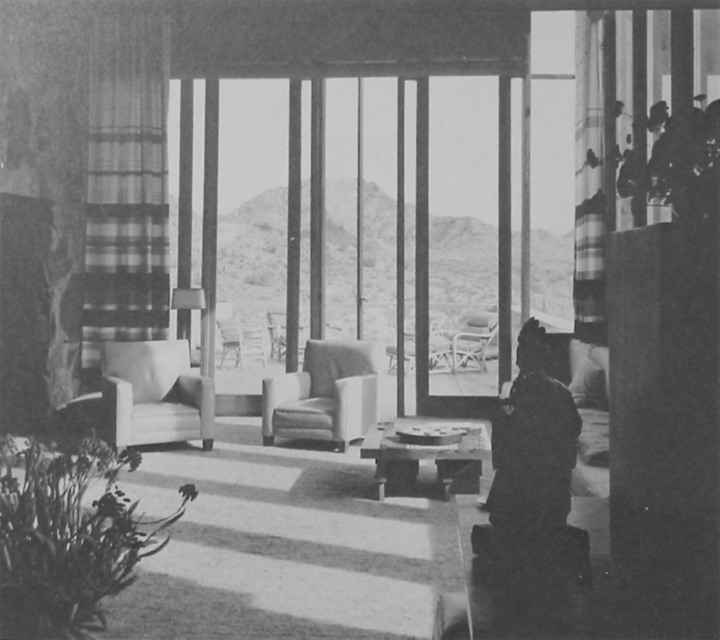
Question: Does smooth leather armchair at center come behind wooden coffee table at center?

Choices:
 (A) yes
 (B) no

Answer: (A)

Question: Among these objects, which one is nearest to the camera?

Choices:
 (A) smooth leather armchair at center
 (B) smooth leather chair at center
 (C) matte beige armchair at center

Answer: (C)

Question: Can you confirm if smooth leather armchair at center is positioned to the left of metallic silver chair at center?

Choices:
 (A) yes
 (B) no

Answer: (A)

Question: Which of the following is the farthest from the observer?

Choices:
 (A) matte beige armchair at center
 (B) smooth leather armchair at center
 (C) smooth leather chair at center

Answer: (C)

Question: Which point appears farthest from the camera in this image?

Choices:
 (A) (374, 468)
 (B) (168, 435)
 (C) (348, 406)
 (D) (495, 349)

Answer: (D)

Question: Where is wooden coffee table at center located in relation to metallic silver chair at center in the image?

Choices:
 (A) below
 (B) above

Answer: (A)